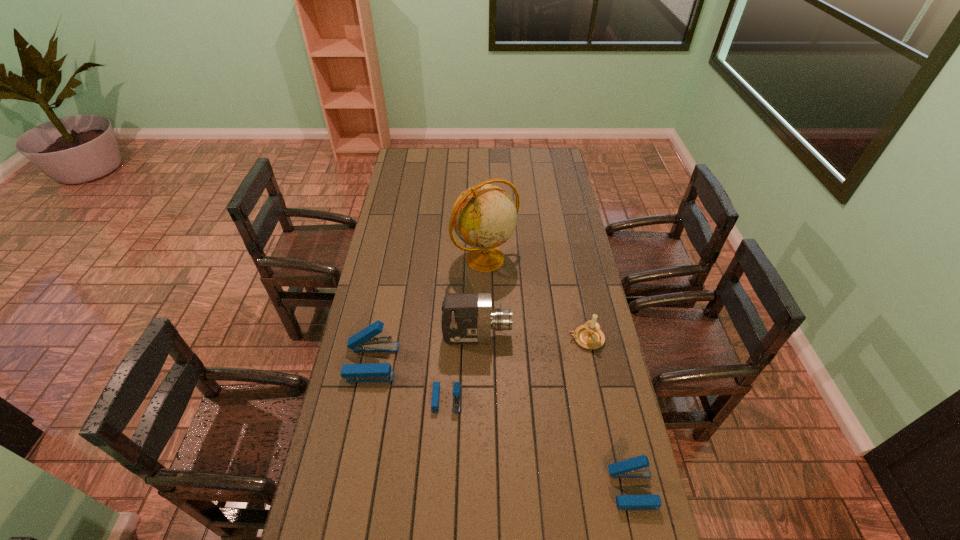
Identify the location of vacant space that is in between the nearest stapler and the leftmost stapler. (502, 426).

Identify the location of vacant space that is in between the fifth shortest object and the second shortest stapler. (555, 413).

You are a GUI agent. You are given a task and a screenshot of the screen. Output one action in this format:
    pyautogui.click(x=<x>, y=<y>)
    Task: Click on the vacant region between the shortest stapler and the leftmost stapler
    
    Given the screenshot: What is the action you would take?
    pyautogui.click(x=409, y=381)

The image size is (960, 540). I want to click on free space between the camcorder and the rightmost stapler, so click(555, 413).

I want to click on vacant area that lies between the leftmost object and the shortest stapler, so click(x=409, y=381).

Identify which object is the nearest to the second stapler from right to left. Please provide its 2D coordinates. Your answer should be formatted as a tuple, i.e. [(x, y)], where the tuple contains the x and y coordinates of a point satisfying the conditions above.

[(364, 341)]

Select which object appears as the closest to the candle holder. Please provide its 2D coordinates. Your answer should be formatted as a tuple, i.e. [(x, y)], where the tuple contains the x and y coordinates of a point satisfying the conditions above.

[(467, 318)]

Identify which stapler is located as the second nearest to the shortest object. Please provide its 2D coordinates. Your answer should be formatted as a tuple, i.e. [(x, y)], where the tuple contains the x and y coordinates of a point satisfying the conditions above.

[(637, 467)]

Identify which stapler is located as the second nearest to the fifth shortest object. Please provide its 2D coordinates. Your answer should be formatted as a tuple, i.e. [(x, y)], where the tuple contains the x and y coordinates of a point satisfying the conditions above.

[(364, 341)]

What are the coordinates of `vacant space that satisfies the following two spatial constraints: 1. at the front of the nearest stapler, highlighting the lens; 2. on the right side of the second tallest object` in the screenshot? It's located at [476, 489].